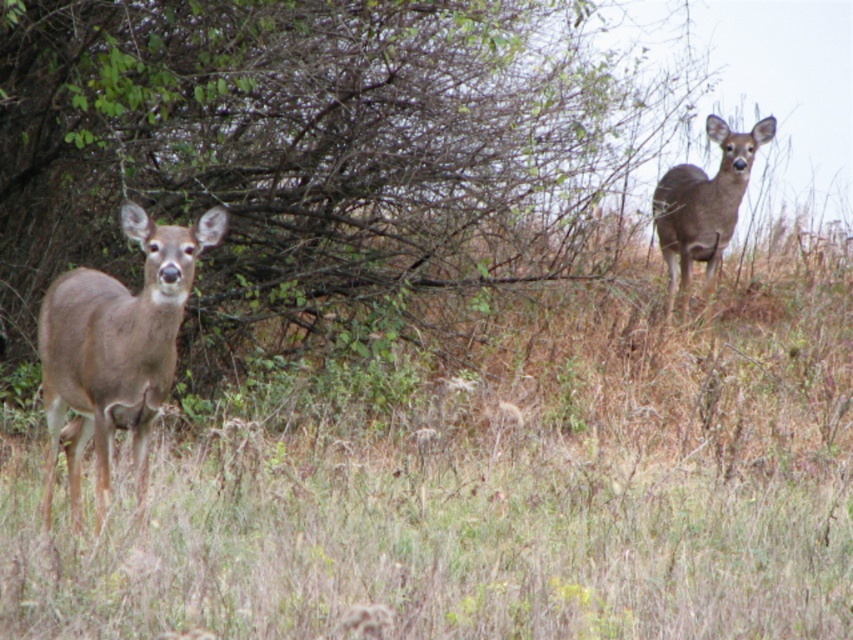
Question: Estimate the real-world distances between objects in this image. Which object is farther from the brown dry grass at center?

Choices:
 (A) brown matte/deer at upper right
 (B) brown matte deer at left

Answer: (A)

Question: Considering the relative positions of brown dry grass at center and brown matte/deer at upper right in the image provided, where is brown dry grass at center located with respect to brown matte/deer at upper right?

Choices:
 (A) above
 (B) below

Answer: (B)

Question: Which object is farther from the camera taking this photo?

Choices:
 (A) brown leafy tree at center
 (B) brown dry grass at center

Answer: (B)

Question: Among these objects, which one is nearest to the camera?

Choices:
 (A) brown matte deer at left
 (B) brown leafy tree at center
 (C) brown dry grass at center
 (D) brown matte/deer at upper right

Answer: (A)

Question: From the image, what is the correct spatial relationship of brown matte deer at left in relation to brown matte/deer at upper right?

Choices:
 (A) above
 (B) below

Answer: (B)

Question: Is brown leafy tree at center thinner than brown matte deer at left?

Choices:
 (A) no
 (B) yes

Answer: (A)